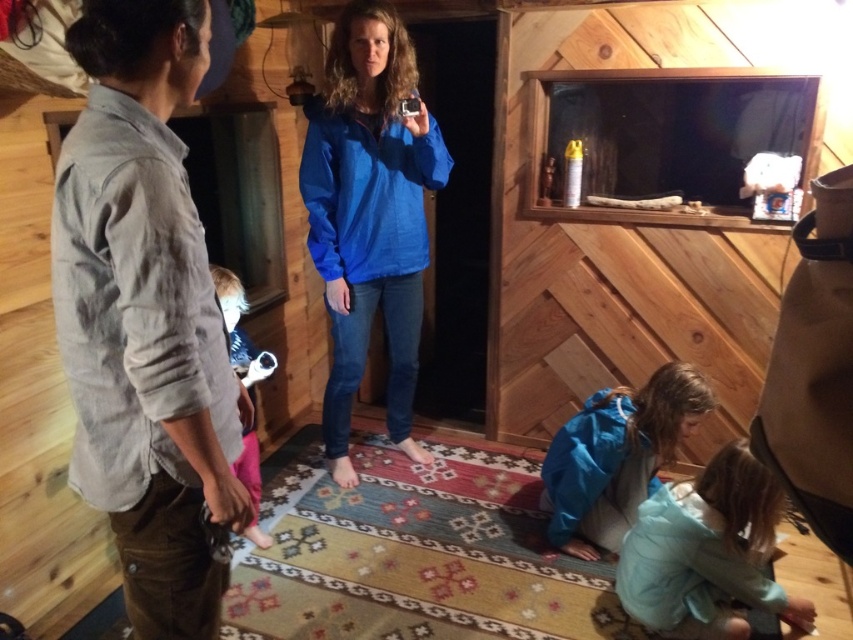
Question: Which point appears farthest from the camera in this image?

Choices:
 (A) (694, 593)
 (B) (155, 541)
 (C) (622, 476)
 (D) (248, 540)

Answer: (D)

Question: Is blue fabric jacket at lower center wider than pink fabric at lower left?

Choices:
 (A) no
 (B) yes

Answer: (B)

Question: Is blue matte jacket at center to the right of blue fabric jacket at lower center from the viewer's perspective?

Choices:
 (A) yes
 (B) no

Answer: (B)

Question: Based on their relative distances, which object is nearer to the light blue fabric at lower right?

Choices:
 (A) gray cotton shirt at left
 (B) blue matte jacket at center

Answer: (B)

Question: Does gray cotton shirt at left appear on the left side of blue matte jacket at center?

Choices:
 (A) no
 (B) yes

Answer: (B)

Question: Among these points, which one is nearest to the camera?

Choices:
 (A) (614, 589)
 (B) (404, 35)
 (C) (236, 288)
 (D) (575, 513)

Answer: (A)